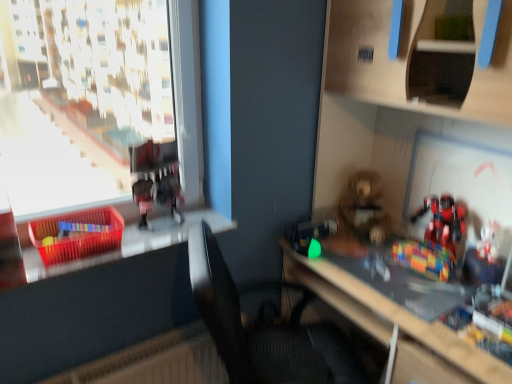
Question: Is transparent plastic window at left oriented away from black fabric chair at center?

Choices:
 (A) no
 (B) yes

Answer: (A)

Question: Could you tell me if transparent plastic window at left is turned towards black fabric chair at center?

Choices:
 (A) no
 (B) yes

Answer: (A)

Question: Does transparent plastic window at left appear on the left side of black fabric chair at center?

Choices:
 (A) yes
 (B) no

Answer: (A)

Question: Is transparent plastic window at left shorter than black fabric chair at center?

Choices:
 (A) yes
 (B) no

Answer: (A)

Question: Is transparent plastic window at left not inside black fabric chair at center?

Choices:
 (A) no
 (B) yes

Answer: (B)

Question: Is transparent plastic window at left not close to black fabric chair at center?

Choices:
 (A) yes
 (B) no

Answer: (A)

Question: Does translucent plastic crate at left have a larger size compared to translucent plastic basket at left?

Choices:
 (A) no
 (B) yes

Answer: (A)

Question: Is translucent plastic crate at left outside translucent plastic basket at left?

Choices:
 (A) yes
 (B) no

Answer: (A)

Question: Is translucent plastic crate at left not near translucent plastic basket at left?

Choices:
 (A) no
 (B) yes

Answer: (A)

Question: From a real-world perspective, is translucent plastic crate at left on top of translucent plastic basket at left?

Choices:
 (A) yes
 (B) no

Answer: (A)

Question: Is translucent plastic crate at left smaller than translucent plastic basket at left?

Choices:
 (A) no
 (B) yes

Answer: (B)

Question: Is translucent plastic crate at left placed right next to translucent plastic basket at left?

Choices:
 (A) yes
 (B) no

Answer: (B)

Question: From the image's perspective, would you say black fabric chair at center is positioned over shiny metallic robot at right, which ranks as the second toy in right-to-left order?

Choices:
 (A) yes
 (B) no

Answer: (B)